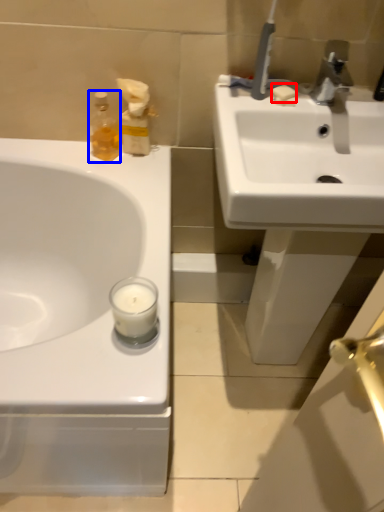
Question: Which object is closer to the camera taking this photo, soap (highlighted by a red box) or soap dispenser (highlighted by a blue box)?

Choices:
 (A) soap
 (B) soap dispenser

Answer: (A)